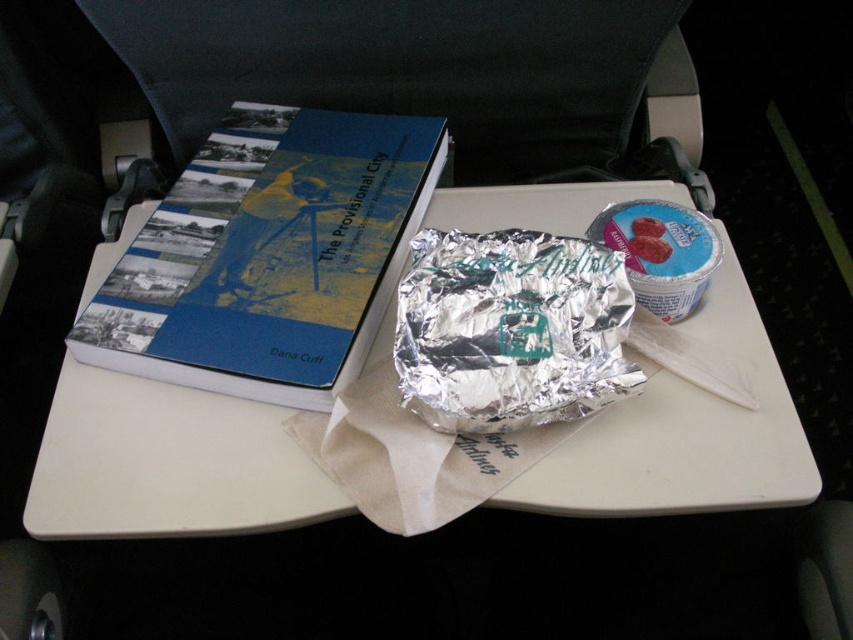
Question: Which point is farther to the camera?

Choices:
 (A) (170, 525)
 (B) (265, 332)
 (C) (439, 282)

Answer: (B)

Question: Which point is closer to the camera?

Choices:
 (A) silver foil wrap at center
 (B) blue matte hardcover book at upper left
 (C) white plastic tray at center

Answer: (A)

Question: Considering the relative positions of white plastic tray at center and silver foil wrap at center in the image provided, where is white plastic tray at center located with respect to silver foil wrap at center?

Choices:
 (A) below
 (B) above

Answer: (B)

Question: Is white plastic tray at center above blue matte hardcover book at upper left?

Choices:
 (A) no
 (B) yes

Answer: (A)

Question: Considering the relative positions of white plastic tray at center and silver foil wrap at center in the image provided, where is white plastic tray at center located with respect to silver foil wrap at center?

Choices:
 (A) right
 (B) left

Answer: (B)

Question: Which of the following is the farthest from the observer?

Choices:
 (A) white plastic tray at center
 (B) blue matte hardcover book at upper left
 (C) silver foil wrap at center

Answer: (B)